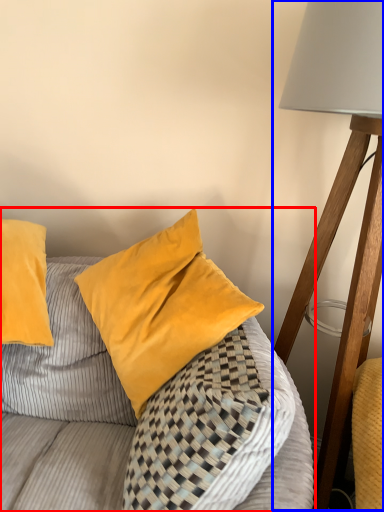
Question: Which of the following is the closest to the observer, furniture (highlighted by a red box) or lamp (highlighted by a blue box)?

Choices:
 (A) furniture
 (B) lamp

Answer: (A)